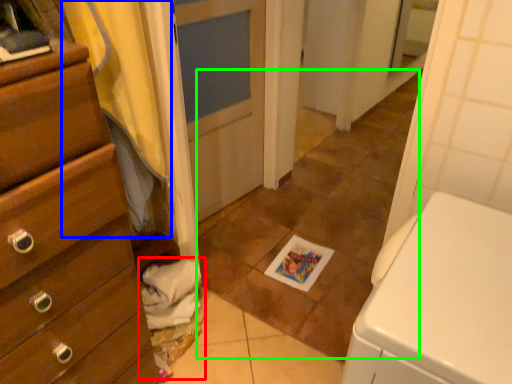
Question: Considering the real-world distances, which object is closest to laundry (highlighted by a red box)? curtain (highlighted by a blue box) or tile (highlighted by a green box).

Choices:
 (A) curtain
 (B) tile

Answer: (A)